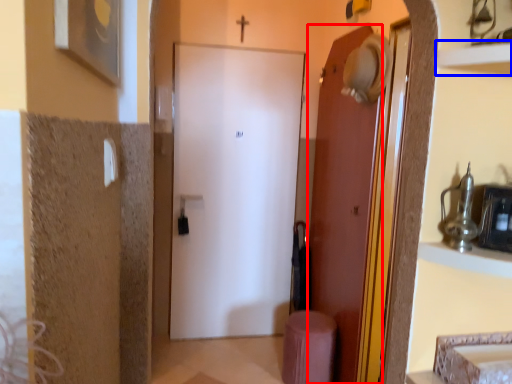
Question: Which point is closer to the camera, door (highlighted by a red box) or shelf (highlighted by a blue box)?

Choices:
 (A) door
 (B) shelf

Answer: (B)